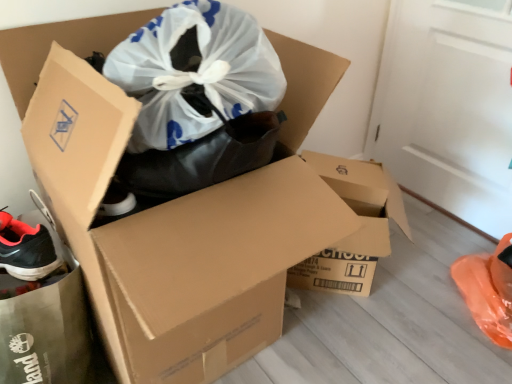
This screenshot has width=512, height=384. What are the coordinates of `black matte shoe at lower left` in the screenshot? It's located at (44, 318).

The width and height of the screenshot is (512, 384). Identify the location of garbage in front of the brown cardboard box at center, the 1th box viewed from the right. (44, 318).

Is black matte shoe at lower left smaller than brown cardboard box at center, the second box in the left-to-right sequence?

Indeed, black matte shoe at lower left has a smaller size compared to brown cardboard box at center, the second box in the left-to-right sequence.

From a real-world perspective, which object rests below the other?

brown cardboard box at center, the second box in the left-to-right sequence, is physically lower.

From the image's perspective, does black matte shoe at lower left appear lower than brown cardboard box at center, the 1th box viewed from the right?

Yes.

Is brown cardboard box at center, the 1th box viewed from the right, looking in the opposite direction of black matte shoe at lower left?

brown cardboard box at center, the 1th box viewed from the right, does not have its back to black matte shoe at lower left.

Would you consider brown cardboard box at center, the 1th box viewed from the right, to be distant from black matte shoe at lower left?

No, brown cardboard box at center, the 1th box viewed from the right, is not far from black matte shoe at lower left.

Where is `garbage lying on the left of brown cardboard box at center, the second box in the left-to-right sequence`? This screenshot has width=512, height=384. garbage lying on the left of brown cardboard box at center, the second box in the left-to-right sequence is located at coordinates (44, 318).

Which object is more forward, brown cardboard box at center, the 1th box viewed from the right, or black matte shoe at lower left?

black matte shoe at lower left is in front.

From a real-world perspective, is brown cardboard box at center, the second box in the left-to-right sequence, physically located above or below brown cardboard box at center, positioned as the first box in left-to-right order?

Clearly, from a real-world perspective, brown cardboard box at center, the second box in the left-to-right sequence, is below brown cardboard box at center, positioned as the first box in left-to-right order.

Is brown cardboard box at center, the 1th box viewed from the right, at the left side of brown cardboard box at center, positioned as the second box in right-to-left order?

No, brown cardboard box at center, the 1th box viewed from the right, is not to the left of brown cardboard box at center, positioned as the second box in right-to-left order.

Considering the relative positions of brown cardboard box at center, the second box in the left-to-right sequence, and brown cardboard box at center, positioned as the first box in left-to-right order, in the image provided, is brown cardboard box at center, the second box in the left-to-right sequence, behind brown cardboard box at center, positioned as the first box in left-to-right order,?

Yes, the depth of brown cardboard box at center, the second box in the left-to-right sequence, is greater than that of brown cardboard box at center, positioned as the first box in left-to-right order.

Based on the photo, from the image's perspective, is brown cardboard box at center, the 1th box viewed from the right, over brown cardboard box at center, positioned as the first box in left-to-right order?

Incorrect, from the image's perspective, brown cardboard box at center, the 1th box viewed from the right, is lower than brown cardboard box at center, positioned as the first box in left-to-right order.

Which is further, (x=234, y=198) or (x=65, y=333)?

The point (x=65, y=333) is more distant.

Would you consider brown cardboard box at center, positioned as the first box in left-to-right order, to be distant from black matte shoe at lower left?

They are positioned close to each other.

Which of these two, brown cardboard box at center, positioned as the second box in right-to-left order, or black matte shoe at lower left, stands shorter?

black matte shoe at lower left.

Is brown cardboard box at center, positioned as the first box in left-to-right order, to the left of black matte shoe at lower left from the viewer's perspective?

In fact, brown cardboard box at center, positioned as the first box in left-to-right order, is to the right of black matte shoe at lower left.

Would you say brown cardboard box at center, positioned as the second box in right-to-left order, is outside brown cardboard box at center, the 1th box viewed from the right?

Yes, brown cardboard box at center, positioned as the second box in right-to-left order, is located beyond the bounds of brown cardboard box at center, the 1th box viewed from the right.

Which object is wider, brown cardboard box at center, positioned as the first box in left-to-right order, or brown cardboard box at center, the 1th box viewed from the right?

With larger width is brown cardboard box at center, positioned as the first box in left-to-right order.

Is brown cardboard box at center, positioned as the second box in right-to-left order, in front of brown cardboard box at center, the second box in the left-to-right sequence?

Yes, brown cardboard box at center, positioned as the second box in right-to-left order, is closer to the camera.

Based on the photo, from the image's perspective, would you say brown cardboard box at center, positioned as the first box in left-to-right order, is shown under brown cardboard box at center, the second box in the left-to-right sequence?

No, from the image's perspective, brown cardboard box at center, positioned as the first box in left-to-right order, is not beneath brown cardboard box at center, the second box in the left-to-right sequence.

Which is in front, point (54, 239) or point (95, 274)?

The point (95, 274) is closer to the camera.

Where is `the 2nd box above the black matte shoe at lower left (from the image's perspective)`? The image size is (512, 384). the 2nd box above the black matte shoe at lower left (from the image's perspective) is located at coordinates (84, 163).

Considering the sizes of objects black matte shoe at lower left and brown cardboard box at center, positioned as the second box in right-to-left order, in the image provided, who is wider, black matte shoe at lower left or brown cardboard box at center, positioned as the second box in right-to-left order,?

brown cardboard box at center, positioned as the second box in right-to-left order.

The height and width of the screenshot is (384, 512). What are the coordinates of `garbage above the brown cardboard box at center, the second box in the left-to-right sequence (from a real-world perspective)` in the screenshot? It's located at (44, 318).

The height and width of the screenshot is (384, 512). In order to click on garbage in front of the brown cardboard box at center, the second box in the left-to-right sequence in this screenshot , I will do `click(44, 318)`.

Estimate the real-world distances between objects in this image. Which object is closer to black matte shoe at lower left, brown cardboard box at center, the 1th box viewed from the right, or brown cardboard box at center, positioned as the first box in left-to-right order?

brown cardboard box at center, positioned as the first box in left-to-right order, lies closer to black matte shoe at lower left than the other object.

When comparing their distances from brown cardboard box at center, positioned as the first box in left-to-right order, does black matte shoe at lower left or brown cardboard box at center, the second box in the left-to-right sequence, seem closer?

black matte shoe at lower left.

Which object lies further to the anchor point brown cardboard box at center, the second box in the left-to-right sequence, black matte shoe at lower left or brown cardboard box at center, positioned as the second box in right-to-left order?

black matte shoe at lower left is positioned further to the anchor brown cardboard box at center, the second box in the left-to-right sequence.

Looking at this image, considering their positions, is brown cardboard box at center, positioned as the first box in left-to-right order, positioned closer to brown cardboard box at center, the second box in the left-to-right sequence, than black matte shoe at lower left?

Among the two, brown cardboard box at center, positioned as the first box in left-to-right order, is located nearer to brown cardboard box at center, the second box in the left-to-right sequence.

Which object lies nearer to the anchor point black matte shoe at lower left, brown cardboard box at center, positioned as the first box in left-to-right order, or brown cardboard box at center, the 1th box viewed from the right?

brown cardboard box at center, positioned as the first box in left-to-right order, is positioned closer to the anchor black matte shoe at lower left.

Estimate the real-world distances between objects in this image. Which object is closer to brown cardboard box at center, positioned as the first box in left-to-right order, brown cardboard box at center, the 1th box viewed from the right, or black matte shoe at lower left?

Based on the image, black matte shoe at lower left appears to be nearer to brown cardboard box at center, positioned as the first box in left-to-right order.

What are the coordinates of `box between black matte shoe at lower left and brown cardboard box at center, the 1th box viewed from the right` in the screenshot? It's located at (84, 163).